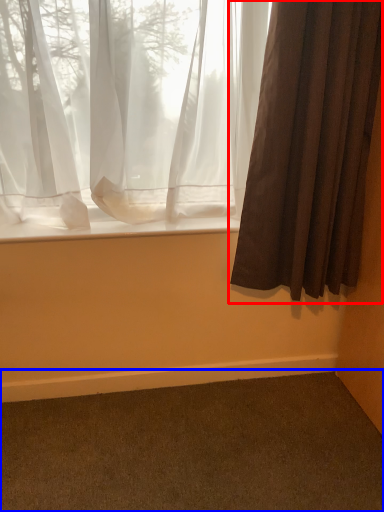
Question: Among these objects, which one is nearest to the camera, curtain (highlighted by a red box) or plain (highlighted by a blue box)?

Choices:
 (A) curtain
 (B) plain

Answer: (B)